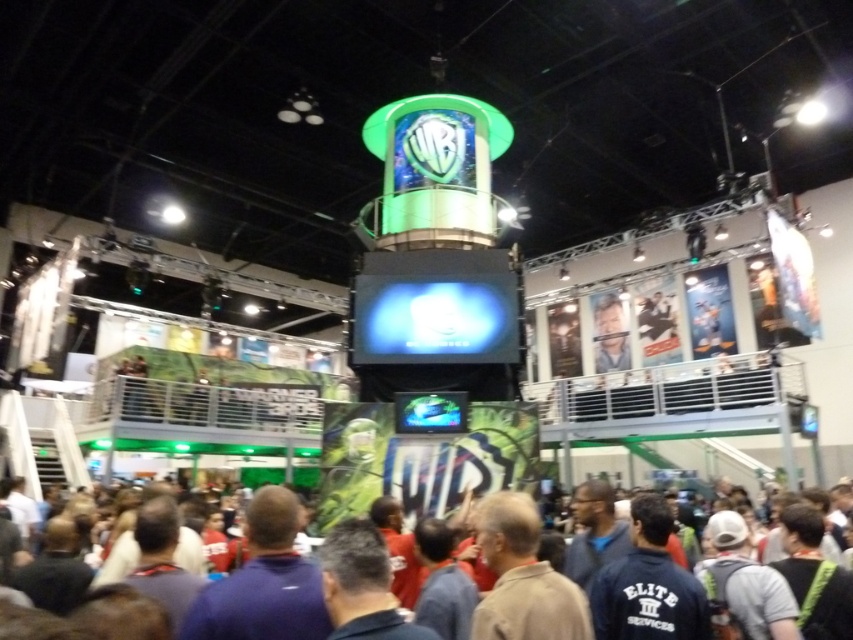
Is brown fabric shirt at lower center behind light blue shirt at center?

No, it is not.

Does brown fabric shirt at lower center appear under light blue shirt at center?

Yes.

Who is more distant from viewer, [270,620] or [592,340]?

Positioned behind is point [592,340].

This screenshot has width=853, height=640. I want to click on brown fabric shirt at lower center, so click(577, 584).